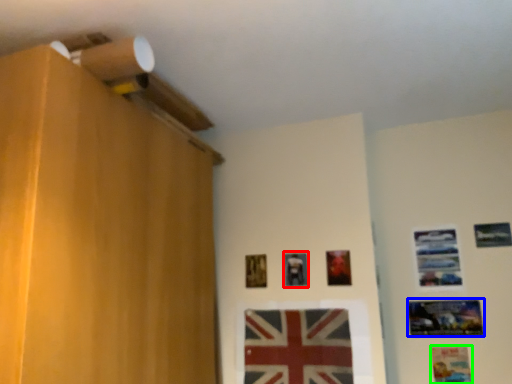
Question: Which object is the closest to the picture frame (highlighted by a red box)? Choose among these: picture frame (highlighted by a blue box) or picture frame (highlighted by a green box).

Choices:
 (A) picture frame
 (B) picture frame

Answer: (A)